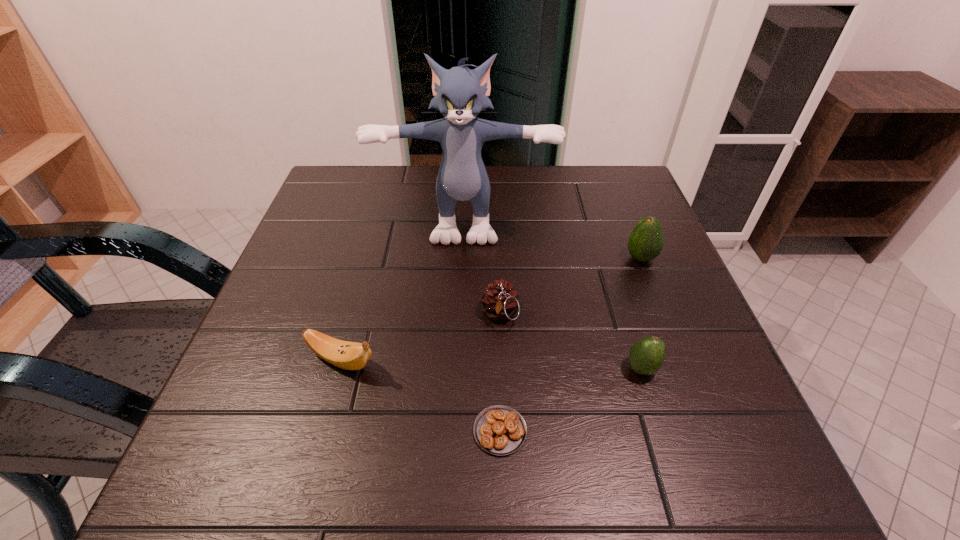
Image resolution: width=960 pixels, height=540 pixels. In order to click on free spot located on the front-facing side of the farthest object in this screenshot , I will do `click(459, 356)`.

Locate an element on the screen. The width and height of the screenshot is (960, 540). vacant region located 0.120m on the back of the taller avocado is located at coordinates (624, 217).

Locate an element on the screen. free location located 0.200m on the right of the banana is located at coordinates tap(493, 361).

This screenshot has height=540, width=960. I want to click on free space located 0.250m with a leaf charm attached to the pinecone, so click(506, 466).

In order to click on free space located on the back of the left avocado in this screenshot , I will do [604, 249].

Where is `vacant space located on the left of the shortest object`? The width and height of the screenshot is (960, 540). vacant space located on the left of the shortest object is located at coordinates (331, 431).

Where is `object that is at the far edge`? The image size is (960, 540). object that is at the far edge is located at coordinates (460, 94).

What are the coordinates of `object that is at the near edge` in the screenshot? It's located at (500, 430).

The width and height of the screenshot is (960, 540). What are the coordinates of `object positioned at the left edge` in the screenshot? It's located at tap(347, 355).

This screenshot has height=540, width=960. In the image, there is a desktop. Identify the location of vacant space at the far edge. (375, 215).